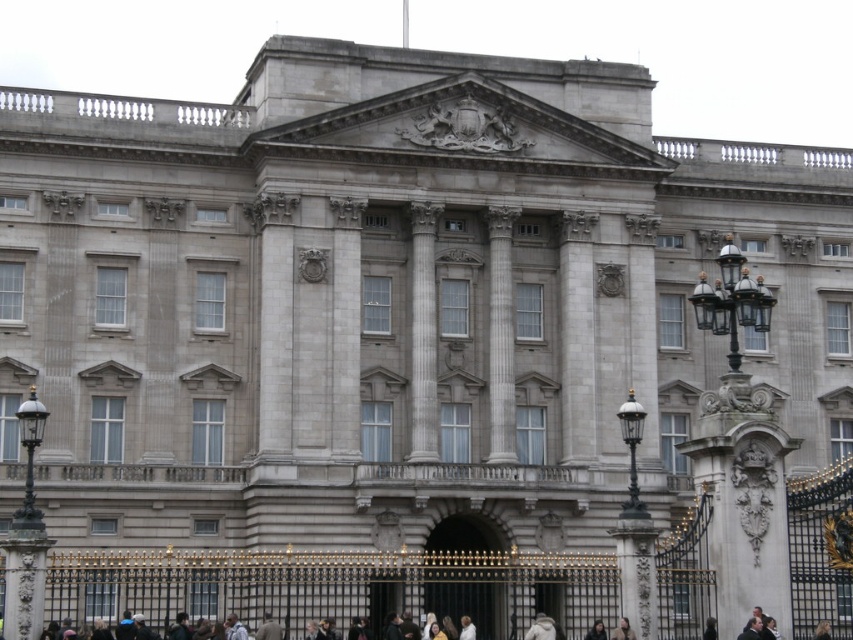
Is point (843, 616) positioned in front of point (595, 628)?

No, it is behind (595, 628).

Does dark clothing at lower center appear on the left side of dark brown hair at center?

Indeed, dark clothing at lower center is positioned on the left side of dark brown hair at center.

Image resolution: width=853 pixels, height=640 pixels. What do you see at coordinates (824, 628) in the screenshot?
I see `dark clothing at lower center` at bounding box center [824, 628].

Where is `dark clothing at lower center`? The image size is (853, 640). dark clothing at lower center is located at coordinates (824, 628).

Between gold ornate gate at center and dark clothing at lower center, which one is positioned lower?

gold ornate gate at center is below.

Who is taller, gold ornate gate at center or dark clothing at lower center?

Standing taller between the two is gold ornate gate at center.

Where is `gold ornate gate at center`? gold ornate gate at center is located at coordinates (462, 572).

Who is more distant from viewer, (445, 518) or (602, 621)?

Positioned behind is point (445, 518).

Describe the element at coordinates (462, 572) in the screenshot. I see `gold ornate gate at center` at that location.

The width and height of the screenshot is (853, 640). Find the location of `gold ornate gate at center`. gold ornate gate at center is located at coordinates (462, 572).